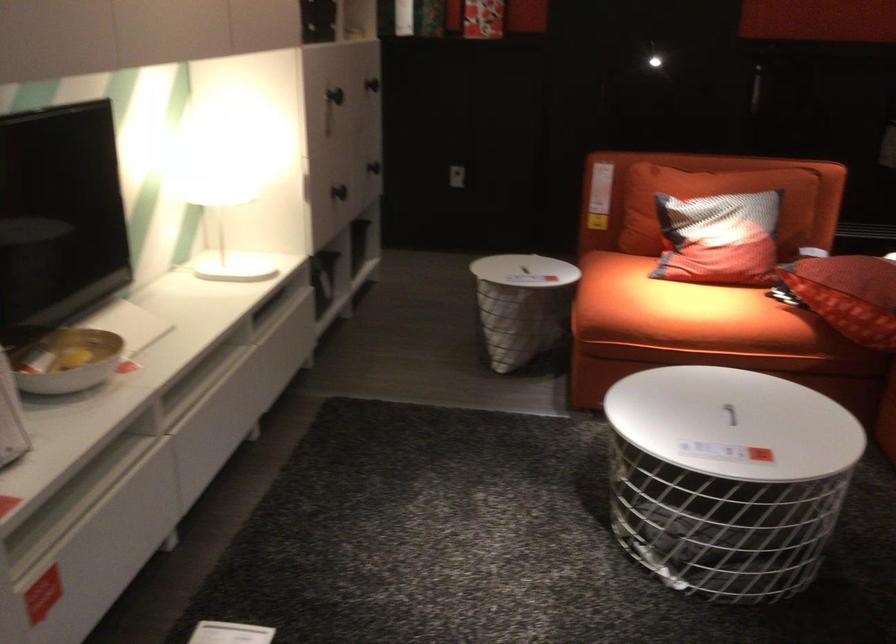
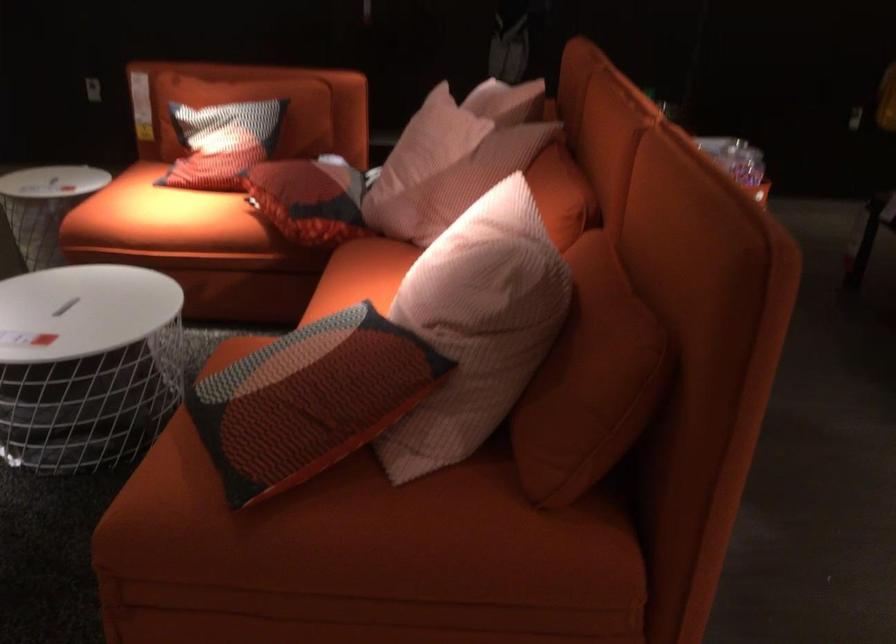
Question: What movement of the cameraman would produce the second image?

Choices:
 (A) Left
 (B) Right
 (C) Forward
 (D) Backward

Answer: (B)